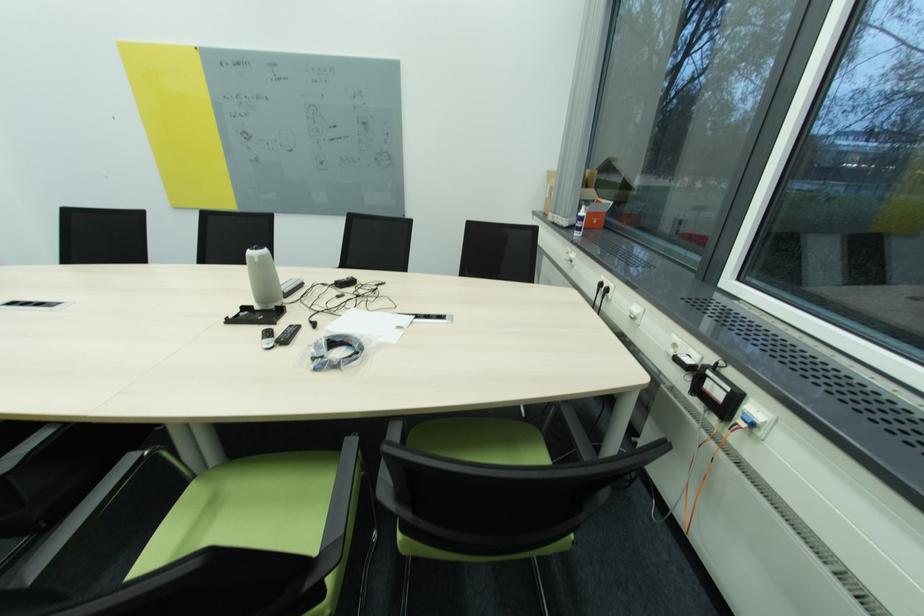
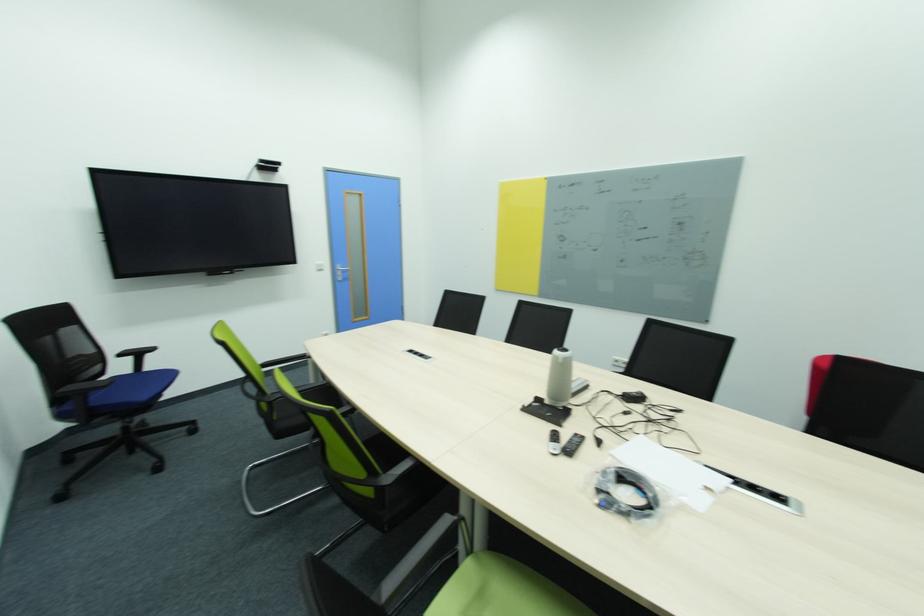
Question: Based on the continuous images, in which direction is the camera rotating? Reply with the corresponding letter.

Choices:
 (A) Left
 (B) Right
 (C) Up
 (D) Down

Answer: (A)